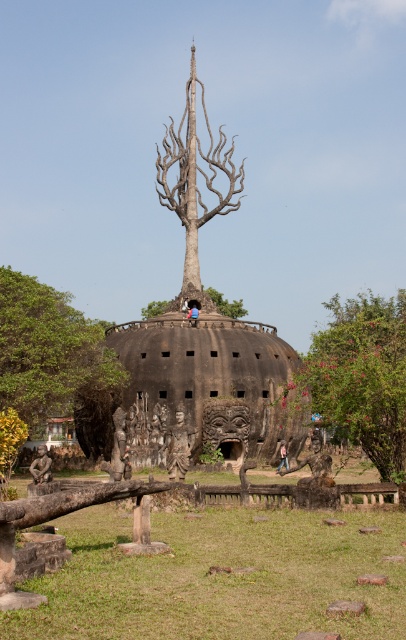
Question: Among these objects, which one is farthest from the camera?

Choices:
 (A) dark brown wooden statue at lower left
 (B) green leafy tree at lower left
 (C) green leafy tree at left
 (D) brown/dead wood tree at center

Answer: (D)

Question: Which point is farther to the camera?

Choices:
 (A) green leafy tree at left
 (B) dark brown wooden statue at lower left
 (C) brown/dead wood tree at center
 (D) green leafy tree at lower right

Answer: (C)

Question: Which object is positioned closest to the green leafy tree at left?

Choices:
 (A) pink fabric person at center
 (B) brown/dead wood tree at center
 (C) dark brown wooden statue at lower left

Answer: (C)

Question: Is the position of brown/dead wood tree at center more distant than that of dark brown wooden statue at lower left?

Choices:
 (A) no
 (B) yes

Answer: (B)

Question: Is green leafy tree at left closer to camera compared to brown/dead wood tree at center?

Choices:
 (A) yes
 (B) no

Answer: (A)

Question: Can you confirm if green leafy tree at left is positioned below wooden statue at center?

Choices:
 (A) no
 (B) yes

Answer: (A)